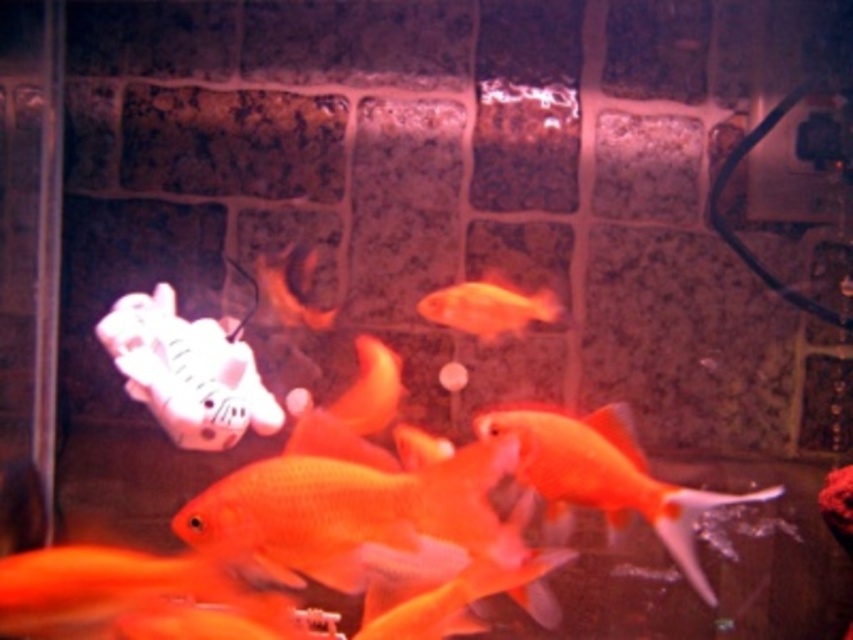
You are standing in front of an aquarium and see a point marked at coordinates (604, 477). What object in the aquarium corresponds to this point?

The point at coordinates (604, 477) corresponds to the glossy orange goldfish at center.

You are an aquarium maintenance worker who needs to clean the tank. You have a net that can reach up to 15 inches. There are two goldfish in the tank, the glossy orange goldfish at center and the orange matte goldfish at center. Can you safely catch both goldfish with one net without moving the net?

The glossy orange goldfish at center is 14.94 inches away from the orange matte goldfish at center. Since the distance between them is less than the net reach of 15 inches, you can safely catch both goldfish with one net without moving it.